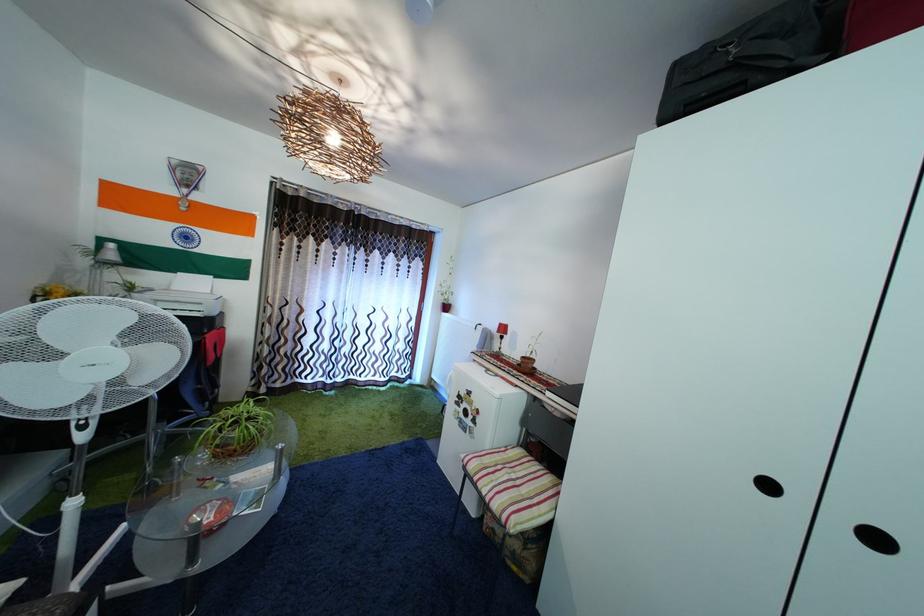
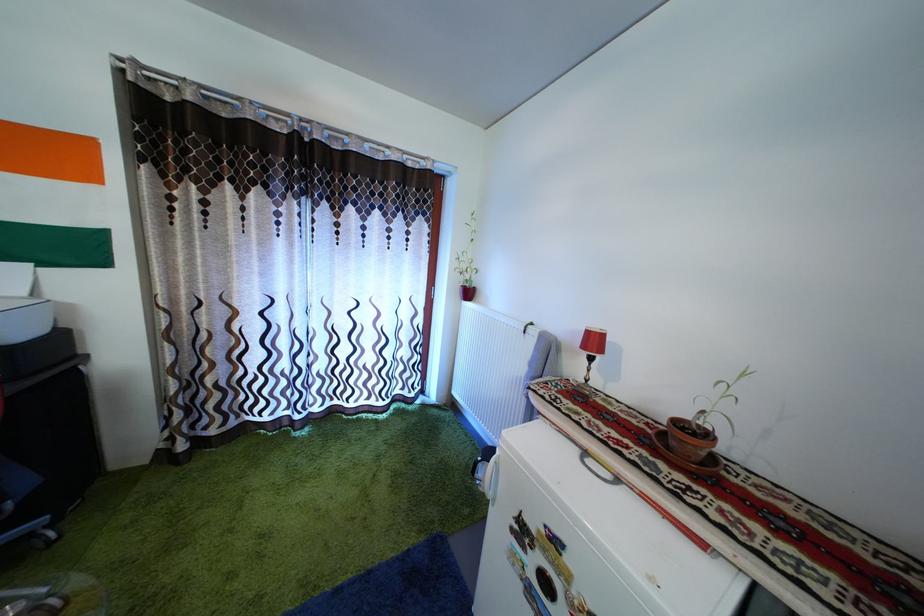
Locate, in the second image, the point that corresponds to point (541, 368) in the first image.

(715, 442)